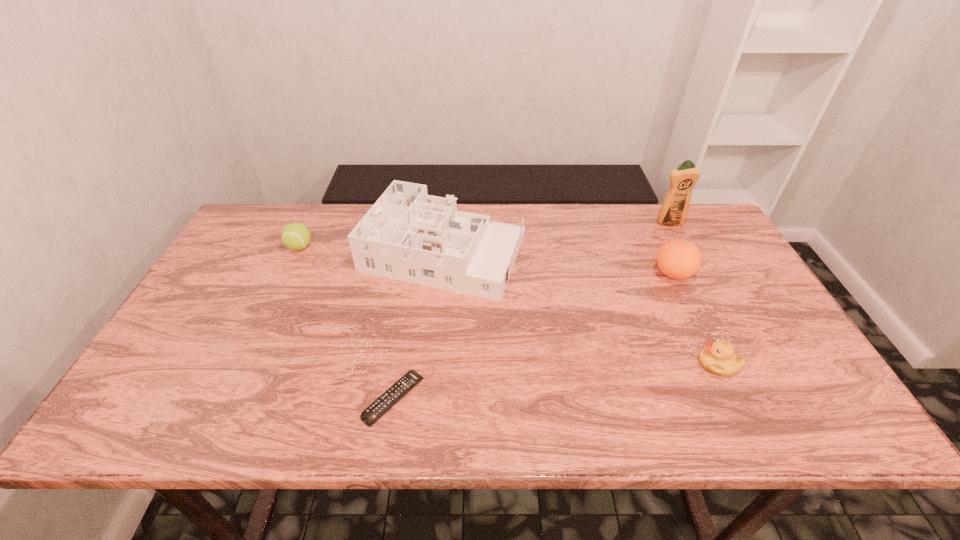
What are the coordinates of `free region located on the front-facing side of the duckling` in the screenshot? It's located at (609, 363).

At what (x,y) coordinates should I click in order to perform the action: click on vacant area situated on the front-facing side of the duckling. Please return your answer as a coordinate pair (x, y). Looking at the image, I should click on (643, 363).

The height and width of the screenshot is (540, 960). I want to click on vacant space situated 0.330m on the front-facing side of the duckling, so click(558, 363).

You are a GUI agent. You are given a task and a screenshot of the screen. Output one action in this format:
    pyautogui.click(x=<x>, y=<y>)
    Task: Click on the vacant space located on the left of the remote control
    The width and height of the screenshot is (960, 540).
    Given the screenshot: What is the action you would take?
    pyautogui.click(x=187, y=399)

Find the location of a particular element. This screenshot has width=960, height=540. detergent present at the far edge is located at coordinates (674, 210).

The width and height of the screenshot is (960, 540). Find the location of `dollhouse located in the far edge section of the desktop`. dollhouse located in the far edge section of the desktop is located at coordinates coord(408,235).

Where is `tennis ball that is at the far edge`? The width and height of the screenshot is (960, 540). tennis ball that is at the far edge is located at coordinates (295, 236).

This screenshot has height=540, width=960. Identify the location of object that is at the near edge. (390, 397).

Find the location of a particular element. detergent situated at the right edge is located at coordinates (674, 210).

Where is `orange at the right edge`? The width and height of the screenshot is (960, 540). orange at the right edge is located at coordinates (678, 259).